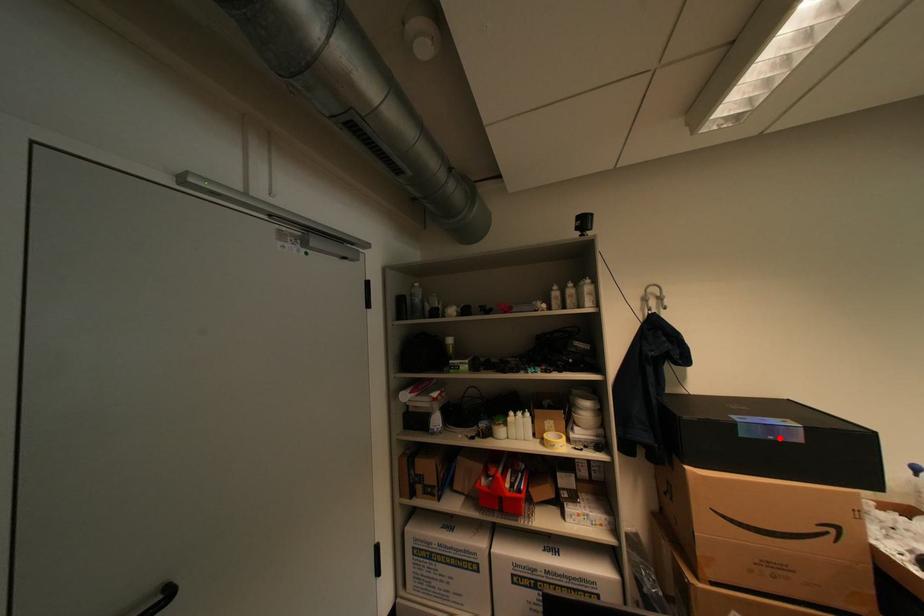
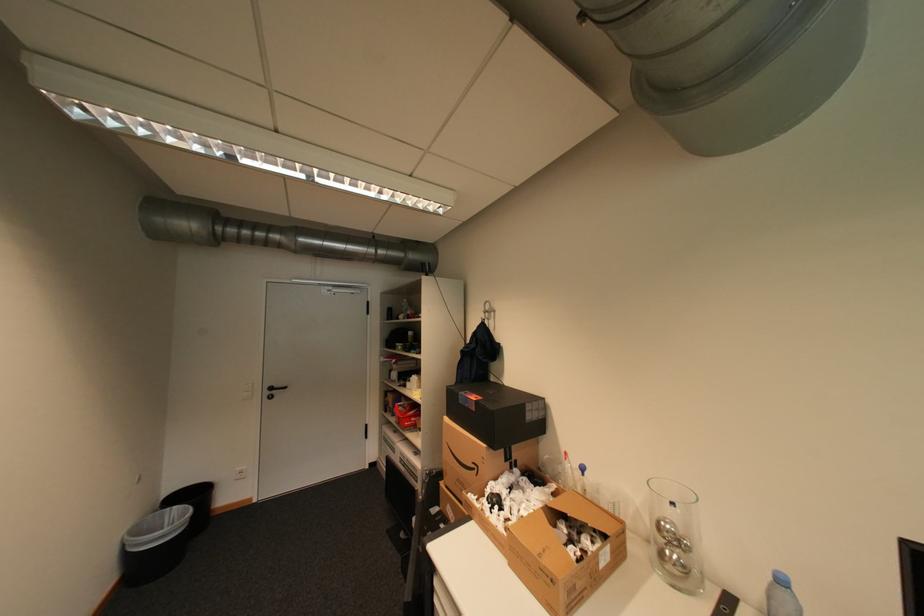
Where in the second image is the point corresponding to the highlighted location from the first image?

(476, 406)